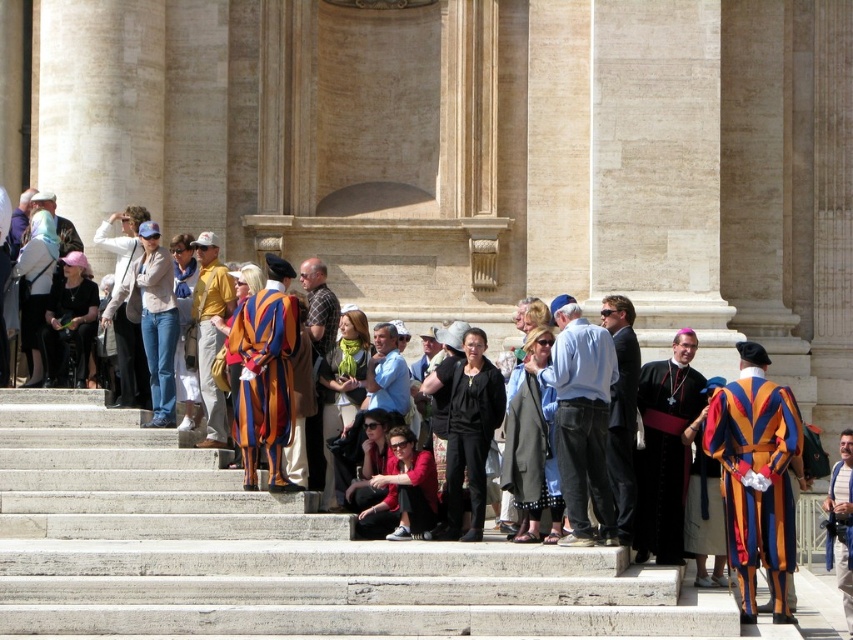
Does blue denim jeans at center appear under matte black robe at center?

No.

Between point (573, 301) and point (670, 470), which one is positioned in front?

Point (670, 470) is in front.

Where is `blue denim jeans at center`? This screenshot has height=640, width=853. blue denim jeans at center is located at coordinates (582, 420).

Which is behind, point (268, 449) or point (314, 470)?

Positioned behind is point (314, 470).

Measure the distance between striped velvet robe at center and camera.

The distance of striped velvet robe at center from camera is 50.46 meters.

Identify the location of striped velvet robe at center. pyautogui.click(x=265, y=378).

Does gray wool coat at center have a lesser height compared to yellow cotton shirt at center?

In fact, gray wool coat at center may be taller than yellow cotton shirt at center.

Between gray wool coat at center and yellow cotton shirt at center, which one is positioned higher?

yellow cotton shirt at center is higher up.

What do you see at coordinates (529, 440) in the screenshot? I see `gray wool coat at center` at bounding box center [529, 440].

Locate an element on the screen. This screenshot has height=640, width=853. gray wool coat at center is located at coordinates (529, 440).